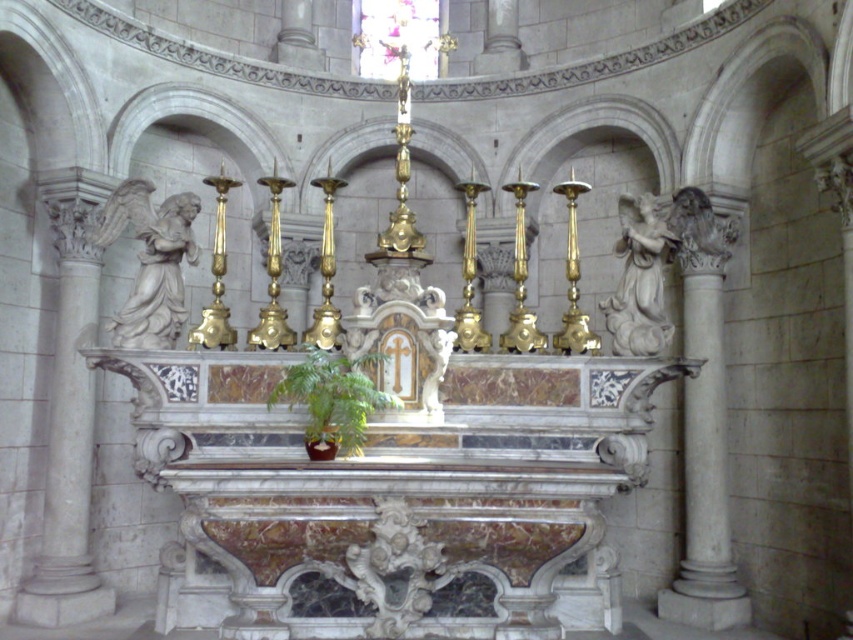
Question: Which object appears farthest from the camera in this image?

Choices:
 (A) white marble angel at left
 (B) white marble angel at right
 (C) white marble column at left
 (D) green leafy plant at center

Answer: (C)

Question: Which point is closer to the camera taking this photo?

Choices:
 (A) (630, 205)
 (B) (318, 387)
 (C) (730, 588)

Answer: (B)

Question: Does white marble angel at left appear on the left side of green leafy plant at center?

Choices:
 (A) no
 (B) yes

Answer: (B)

Question: Can you confirm if white marble angel at left is smaller than green leafy plant at center?

Choices:
 (A) yes
 (B) no

Answer: (B)

Question: Which is nearer to the green leafy plant at center?

Choices:
 (A) white marble column at left
 (B) white marble angel at left
 (C) white marble column at right
 (D) white marble angel at right

Answer: (B)

Question: Is white marble column at right further to camera compared to green leafy plant at center?

Choices:
 (A) yes
 (B) no

Answer: (A)